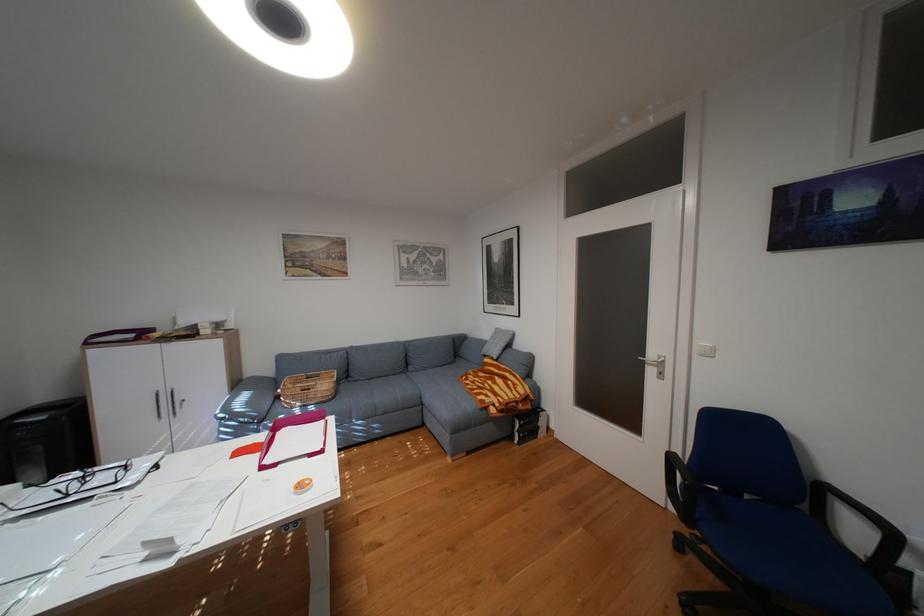
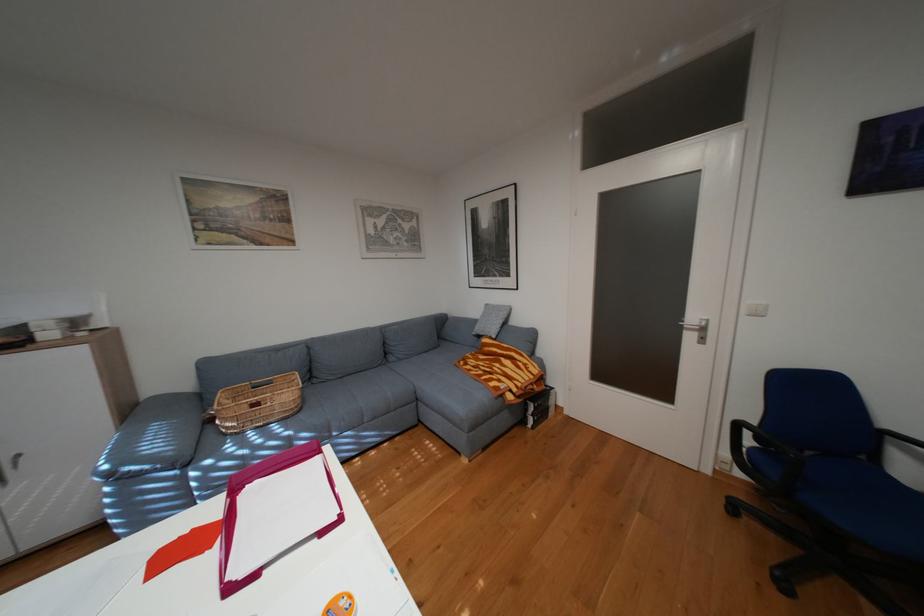
Question: How did the camera likely rotate?

Choices:
 (A) Left
 (B) Right
 (C) Up
 (D) Down

Answer: (B)